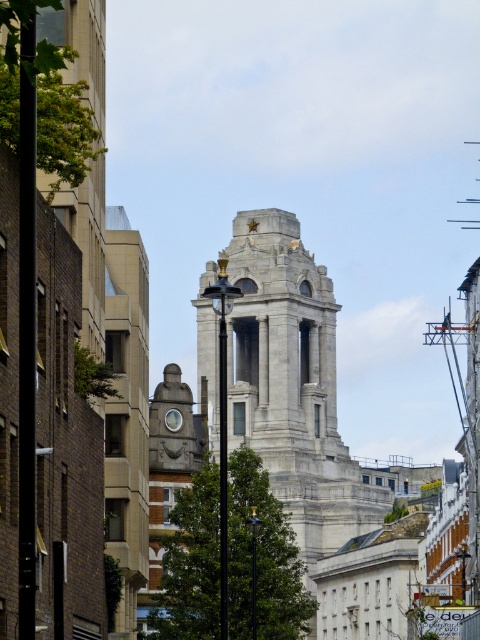
You are a city planner assessing the urban skyline. You need to determine if the gray stone tower at center will block the view of the matte gray clock at center from a viewpoint on the street below. Based on their heights, can the clock be seen above the tower?

The gray stone tower at center is taller than the matte gray clock at center. Since the tower is taller, it would likely block the view of the clock from below, making it difficult to see the matte gray clock at center above the tower.

You are a city planner reviewing this urban layout. You need to determine the spatial relationship between the gray stone tower at center and the matte gray clock at center. Which one is positioned higher in the image?

The matte gray clock at center is positioned higher than the gray stone tower at center because the gray stone tower at center is located below it.

You are a city planner analyzing the urban layout. Given the scene described, how does the size of the gray stone tower at center compare to the matte gray clock at center?

The gray stone tower at center is bigger than the matte gray clock at center.